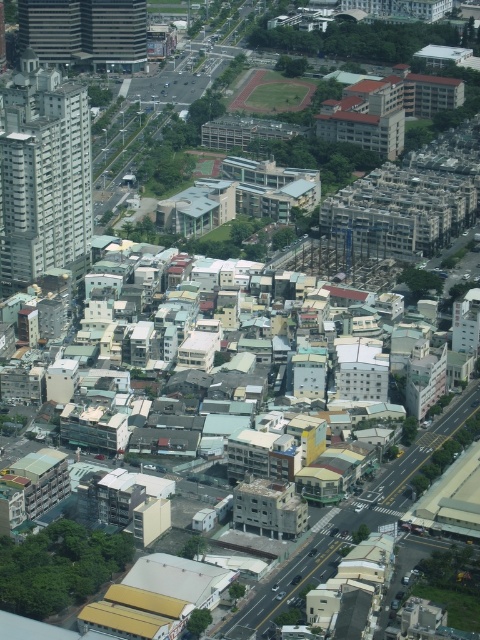
Is gray concrete building at left smaller than matte glass skyscraper at upper left?

Actually, gray concrete building at left might be larger than matte glass skyscraper at upper left.

Is point (23, 252) positioned before point (55, 28)?

Yes, it is in front of point (55, 28).

You are a GUI agent. You are given a task and a screenshot of the screen. Output one action in this format:
    pyautogui.click(x=<x>, y=<y>)
    Task: Click on the gray concrete building at left
    The width and height of the screenshot is (480, 640).
    Given the screenshot: What is the action you would take?
    pyautogui.click(x=44, y=176)

This screenshot has height=640, width=480. I want to click on gray concrete building at left, so click(x=44, y=176).